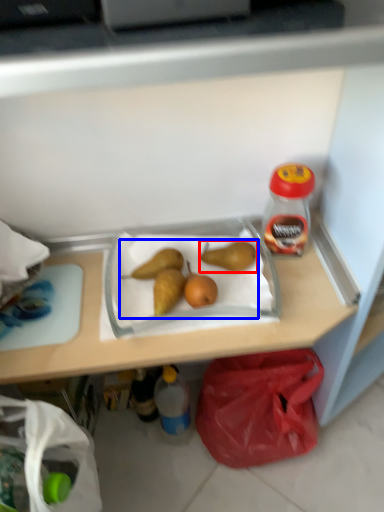
Question: Which object appears closest to the camera in this image, pear (highlighted by a red box) or fruit (highlighted by a blue box)?

Choices:
 (A) pear
 (B) fruit

Answer: (B)